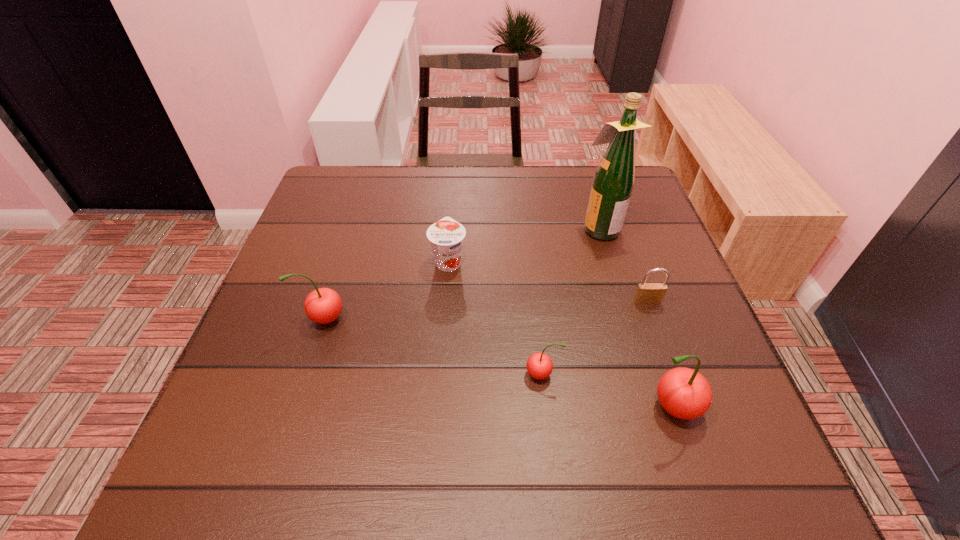
Identify the location of vacant point located between the fourth nearest object and the nearest cherry. (659, 354).

Select which object appears as the second closest to the second nearest object. Please provide its 2D coordinates. Your answer should be formatted as a tuple, i.e. [(x, y)], where the tuple contains the x and y coordinates of a point satisfying the conditions above.

[(647, 293)]

Identify which object is located as the third nearest to the rightmost cherry. Please provide its 2D coordinates. Your answer should be formatted as a tuple, i.e. [(x, y)], where the tuple contains the x and y coordinates of a point satisfying the conditions above.

[(613, 182)]

Identify which cherry is the third closest to the fifth object from right to left. Please provide its 2D coordinates. Your answer should be formatted as a tuple, i.e. [(x, y)], where the tuple contains the x and y coordinates of a point satisfying the conditions above.

[(684, 393)]

Where is `the second closest cherry to the shortest cherry`? the second closest cherry to the shortest cherry is located at coordinates (323, 305).

In order to click on vacant position in the image that satisfies the following two spatial constraints: 1. on the front side of the second nearest cherry; 2. on the left side of the fifth nearest object in this screenshot , I will do `click(440, 374)`.

This screenshot has width=960, height=540. What are the coordinates of `free space that satisfies the following two spatial constraints: 1. on the front side of the fourth farthest object; 2. on the left side of the second farthest cherry` in the screenshot? It's located at (307, 374).